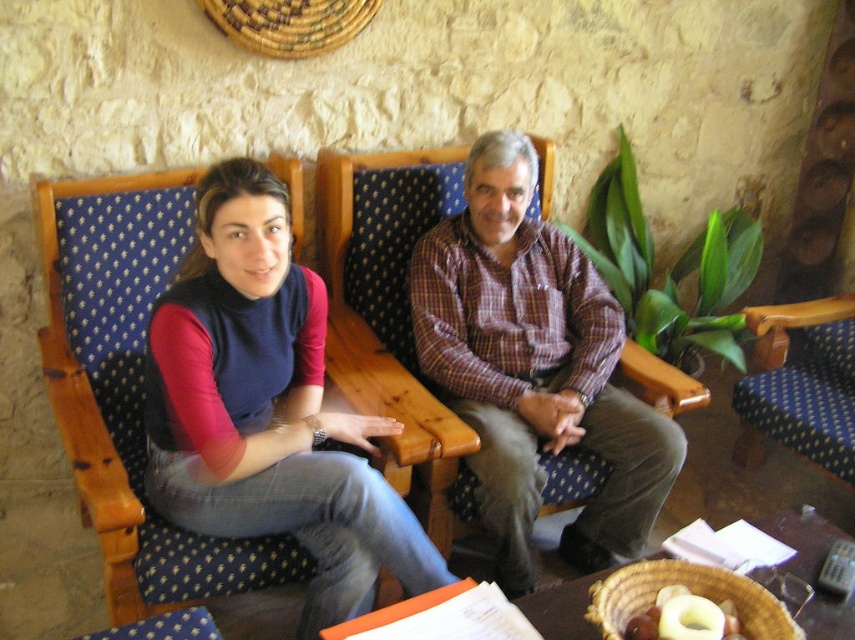
Can you confirm if matte blue fabric chair at upper left is positioned to the right of matte blue jeans at center?

Indeed, matte blue fabric chair at upper left is positioned on the right side of matte blue jeans at center.

Which of these two, matte blue fabric chair at upper left or matte blue jeans at center, stands taller?

With more height is matte blue fabric chair at upper left.

Does point (369, 196) come behind point (284, 225)?

Yes, point (369, 196) is behind point (284, 225).

At what (x,y) coordinates should I click in order to perform the action: click on matte blue fabric chair at upper left. Please return your answer as a coordinate pair (x, y). The width and height of the screenshot is (855, 640). Looking at the image, I should click on (127, 388).

Can you confirm if matte blue fabric chair at upper left is wider than plaid shirt at center?

Yes.

Does matte blue fabric chair at upper left come in front of plaid shirt at center?

That is True.

Does point (142, 300) come in front of point (470, 173)?

That is True.

Identify the location of matte blue fabric chair at upper left. Image resolution: width=855 pixels, height=640 pixels. (127, 388).

Between matte blue jeans at center and yellow fabric armchair at right, which one has less height?

Standing shorter between the two is yellow fabric armchair at right.

Does matte blue jeans at center have a lesser width compared to yellow fabric armchair at right?

No, matte blue jeans at center is not thinner than yellow fabric armchair at right.

Between point (358, 448) and point (753, 451), which one is positioned behind?

Point (753, 451)

The height and width of the screenshot is (640, 855). I want to click on matte blue jeans at center, so click(x=268, y=408).